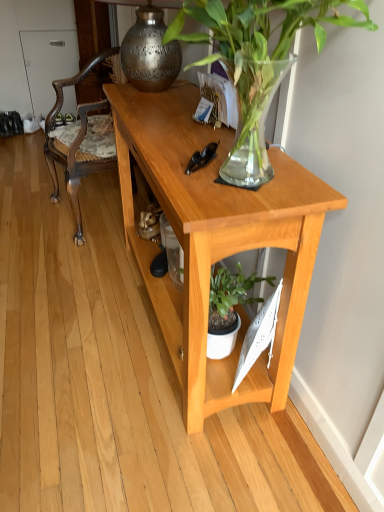
This screenshot has width=384, height=512. I want to click on blank area to the left of black plastic sunglasses at center, so click(163, 161).